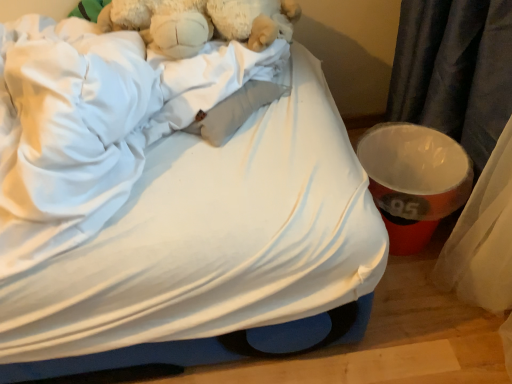
Question: Visually, is fluffy white teddy bear at upper left positioned to the left or to the right of white fabric bed at upper left?

Choices:
 (A) right
 (B) left

Answer: (A)

Question: Is fluffy white teddy bear at upper left taller or shorter than white fabric bed at upper left?

Choices:
 (A) short
 (B) tall

Answer: (A)

Question: Considering the positions of fluffy white teddy bear at upper left and white fabric bed at upper left in the image, is fluffy white teddy bear at upper left bigger or smaller than white fabric bed at upper left?

Choices:
 (A) small
 (B) big

Answer: (A)

Question: From a real-world perspective, is white fabric bed at upper left physically located above or below fluffy white teddy bear at upper left?

Choices:
 (A) above
 (B) below

Answer: (B)

Question: Considering the positions of white fabric bed at upper left and fluffy white teddy bear at upper left in the image, is white fabric bed at upper left wider or thinner than fluffy white teddy bear at upper left?

Choices:
 (A) wide
 (B) thin

Answer: (A)

Question: In the image, is white fabric bed at upper left positioned in front of or behind fluffy white teddy bear at upper left?

Choices:
 (A) front
 (B) behind

Answer: (A)

Question: Is point (352, 172) positioned closer to the camera than point (203, 34)?

Choices:
 (A) closer
 (B) farther

Answer: (A)